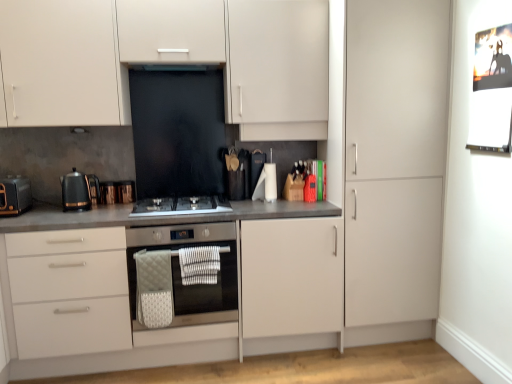
Question: Is point (31, 195) closer or farther from the camera than point (138, 67)?

Choices:
 (A) closer
 (B) farther

Answer: (B)

Question: From the image's perspective, relative to black glass exhaust hood at upper center, is matte black toaster at left, arranged as the second kitchen appliance when viewed from the right, above or below?

Choices:
 (A) below
 (B) above

Answer: (A)

Question: Estimate the real-world distances between objects in this image. Which object is farther from the white textured cloth at lower center?

Choices:
 (A) matte white cabinet at right
 (B) copper metallic toaster at left, the 1th appliance viewed from the left
 (C) matte white cabinets at upper center
 (D) black glass gas stove at center
 (E) matte gray countertop at center

Answer: (A)

Question: Estimate the real-world distances between objects in this image. Which object is farther from the matte white cabinets at upper center?

Choices:
 (A) white textured cloth at lower center
 (B) copper metallic kettle at center-left, the first appliance from the right
 (C) matte gray countertop at center
 (D) stainless steel oven at center
 (E) metallic silver bulletin board at upper right

Answer: (E)